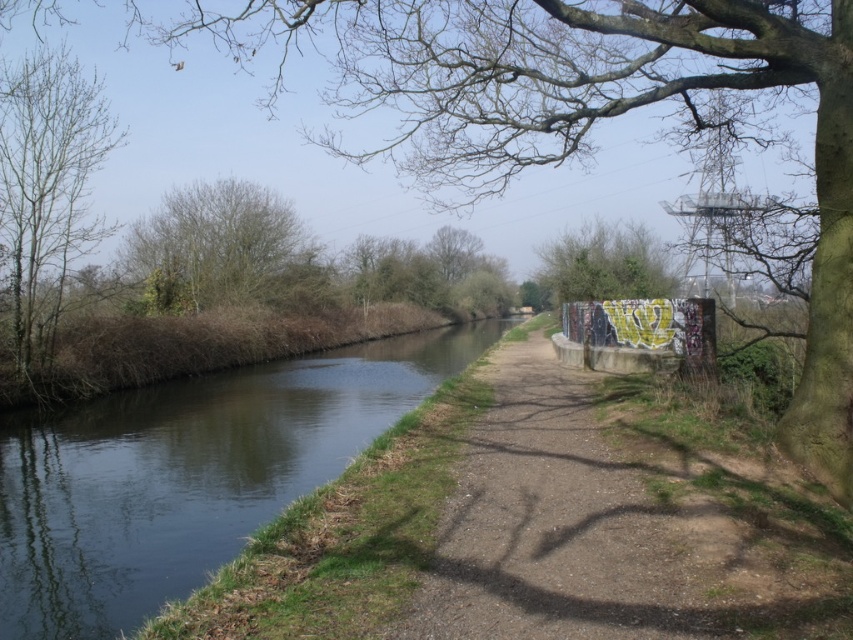
You are standing on a bridge overlooking the green grassy river at left and the bare branches at left. Which object is closer to the water surface?

The green grassy river at left is closer to the water surface because it is positioned below the bare branches at left.